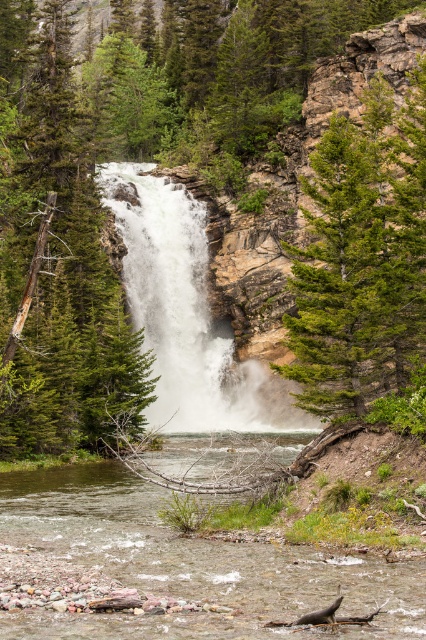
You are a hiker standing at the edge of the river looking towards the waterfall. You see the green matte tree at left and the white frothy water at center. Which object is closer to you?

The green matte tree at left is closer to you because it is in front of the white frothy water at center.

You are a hiker who wants to cross the river using the gravel path. The white frothy water at center is flowing rapidly. Can you safely walk on the brown gravel river at lower center without getting your feet wet?

The brown gravel river at lower center is shorter than the white frothy water at center, so it might be a safer option for crossing since it has less flowing water and is shorter in length, reducing the chance of getting wet.